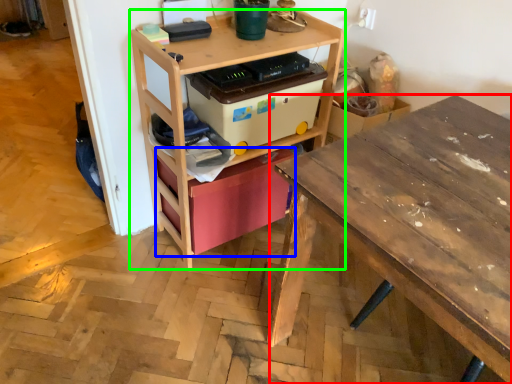
Question: Which is nearer to the desk (highlighted by a red box)? storage box (highlighted by a blue box) or shelf (highlighted by a green box).

Choices:
 (A) storage box
 (B) shelf

Answer: (A)